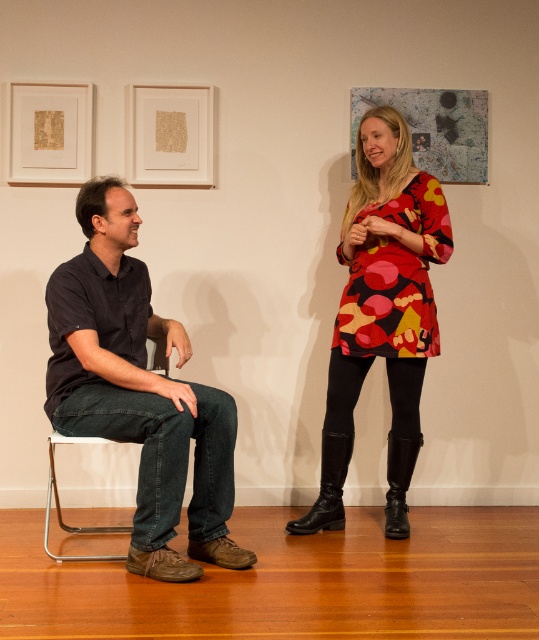
Question: Is printed fabric dress at center above metallic silver chair at left?

Choices:
 (A) yes
 (B) no

Answer: (A)

Question: Does black matte shirt at left appear under printed fabric dress at center?

Choices:
 (A) no
 (B) yes

Answer: (B)

Question: Estimate the real-world distances between objects in this image. Which object is farther from the metallic silver chair at left?

Choices:
 (A) black matte shirt at left
 (B) printed fabric dress at center

Answer: (B)

Question: Which object appears closest to the camera in this image?

Choices:
 (A) printed fabric dress at center
 (B) metallic silver chair at left

Answer: (B)

Question: Does printed fabric dress at center have a greater width compared to metallic silver chair at left?

Choices:
 (A) no
 (B) yes

Answer: (B)

Question: Which of the following is the farthest from the observer?

Choices:
 (A) printed fabric dress at center
 (B) metallic silver chair at left

Answer: (A)